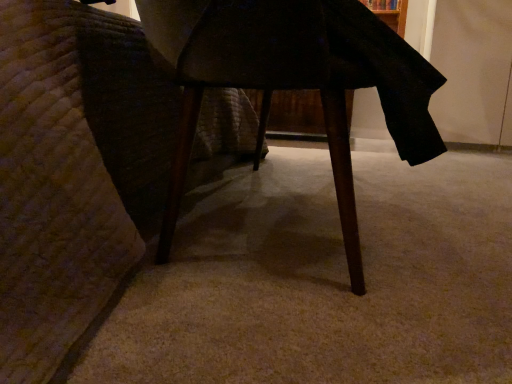
Image resolution: width=512 pixels, height=384 pixels. What are the coordinates of `wooden chair leg at lower left` in the screenshot? It's located at (73, 171).

This screenshot has height=384, width=512. Describe the element at coordinates (73, 171) in the screenshot. I see `wooden chair leg at lower left` at that location.

What do you see at coordinates (293, 80) in the screenshot? This screenshot has width=512, height=384. I see `wooden table at center` at bounding box center [293, 80].

At what (x,y) coordinates should I click in order to perform the action: click on wooden table at center. Please return your answer as a coordinate pair (x, y). The width and height of the screenshot is (512, 384). Looking at the image, I should click on (293, 80).

What is the approximate height of wooden table at center?

The height of wooden table at center is 30.52 inches.

Identify the location of wooden chair leg at lower left. (73, 171).

In the image, is wooden table at center on the left side or the right side of wooden chair leg at lower left?

wooden table at center is to the right of wooden chair leg at lower left.

Considering the positions of objects wooden table at center and wooden chair leg at lower left in the image provided, who is in front, wooden table at center or wooden chair leg at lower left?

wooden chair leg at lower left is more forward.

Considering the points (189, 48) and (62, 181), which point is behind, point (189, 48) or point (62, 181)?

Positioned behind is point (189, 48).

From the image's perspective, is wooden table at center located above wooden chair leg at lower left?

No, from the image's perspective, wooden table at center is not over wooden chair leg at lower left.

From a real-world perspective, relative to wooden chair leg at lower left, is wooden table at center vertically above or below?

wooden table at center is situated lower than wooden chair leg at lower left in the real world.

Between wooden table at center and wooden chair leg at lower left, which one has larger width?

wooden chair leg at lower left.

Which of these two, wooden table at center or wooden chair leg at lower left, stands taller?

Standing taller between the two is wooden chair leg at lower left.

Considering the relative sizes of wooden table at center and wooden chair leg at lower left in the image provided, is wooden table at center bigger than wooden chair leg at lower left?

No.

Is wooden table at center spatially inside wooden chair leg at lower left, or outside of it?

wooden table at center is located inside wooden chair leg at lower left.

Would you consider wooden table at center to be distant from wooden chair leg at lower left?

No, wooden table at center is in close proximity to wooden chair leg at lower left.

Is wooden table at center turned away from wooden chair leg at lower left?

Yes, wooden table at center is facing away from wooden chair leg at lower left.

Can you tell me how much wooden table at center and wooden chair leg at lower left differ in facing direction?

The angle between the facing direction of wooden table at center and the facing direction of wooden chair leg at lower left is 2.82 degrees.

Measure the distance between wooden table at center and wooden chair leg at lower left.

A distance of 36.42 centimeters exists between wooden table at center and wooden chair leg at lower left.

Locate an element on the screen. Image resolution: width=512 pixels, height=384 pixels. table below the wooden chair leg at lower left (from a real-world perspective) is located at coordinates (293, 80).

Is wooden chair leg at lower left to the left of wooden table at center from the viewer's perspective?

Correct, you'll find wooden chair leg at lower left to the left of wooden table at center.

Which object is further away from the camera taking this photo, wooden chair leg at lower left or wooden table at center?

wooden table at center is further away from the camera.

Considering the positions of point (1, 247) and point (280, 7), is point (1, 247) closer or farther from the camera than point (280, 7)?

Point (1, 247).

From the image's perspective, is wooden chair leg at lower left on wooden table at center?

Yes.

From a real-world perspective, is wooden chair leg at lower left located beneath wooden table at center?

Actually, wooden chair leg at lower left is physically above wooden table at center in the real world.

Considering the sizes of wooden chair leg at lower left and wooden table at center in the image, is wooden chair leg at lower left wider or thinner than wooden table at center?

Clearly, wooden chair leg at lower left has more width compared to wooden table at center.

Between wooden chair leg at lower left and wooden table at center, which one has less height?

wooden table at center is shorter.

Who is bigger, wooden chair leg at lower left or wooden table at center?

With larger size is wooden chair leg at lower left.

Could wooden table at center be considered to be inside wooden chair leg at lower left?

Yes, wooden chair leg at lower left is surrounding wooden table at center.

Is wooden chair leg at lower left positioned far away from wooden table at center?

Actually, wooden chair leg at lower left and wooden table at center are a little close together.

Is wooden chair leg at lower left positioned with its back to wooden table at center?

That's not correct — wooden chair leg at lower left is not looking away from wooden table at center.

How many degrees apart are the facing directions of wooden chair leg at lower left and wooden table at center?

Answer: wooden chair leg at lower left and wooden table at center are facing 2.82 degrees away from each other.

You are a GUI agent. You are given a task and a screenshot of the screen. Output one action in this format:
    pyautogui.click(x=<x>, y=<y>)
    Task: Click on the table below the wooden chair leg at lower left (from the image's perspective)
    
    Given the screenshot: What is the action you would take?
    pyautogui.click(x=293, y=80)

You are a GUI agent. You are given a task and a screenshot of the screen. Output one action in this format:
    pyautogui.click(x=<x>, y=<y>)
    Task: Click on the table below the wooden chair leg at lower left (from a real-world perspective)
    The image size is (512, 384).
    Given the screenshot: What is the action you would take?
    pyautogui.click(x=293, y=80)

I want to click on furniture in front of the wooden table at center, so click(x=73, y=171).